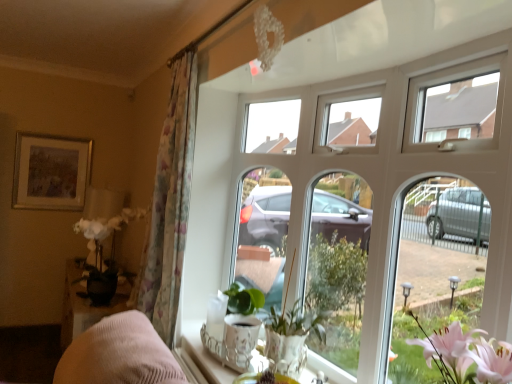
Identify the location of empty space that is ontop of gold-framed painting at upper left. tap(56, 129).